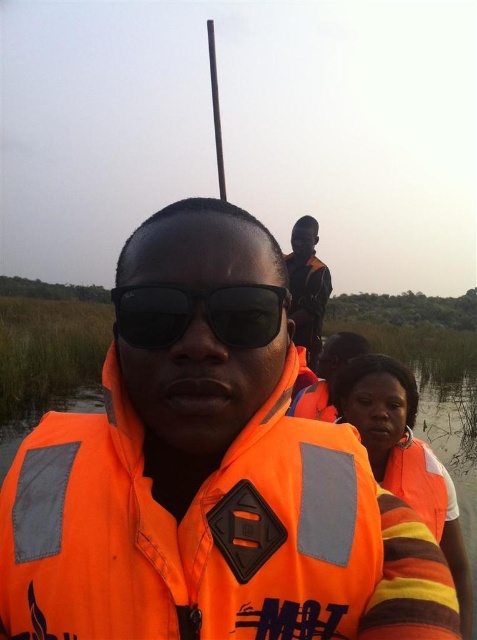
Question: Is orange fabric construction worker at center to the left of orange fabric life jacket at lower right from the viewer's perspective?

Choices:
 (A) yes
 (B) no

Answer: (A)

Question: Which point is closer to the camera?

Choices:
 (A) (276, 323)
 (B) (113, 433)
 (C) (320, 314)
 (D) (429, 486)

Answer: (A)

Question: Can you confirm if orange fabric construction worker at center is wider than orange fabric life jacket at lower right?

Choices:
 (A) yes
 (B) no

Answer: (A)

Question: Based on their relative distances, which object is farther from the orange fabric construction worker at center?

Choices:
 (A) orange fabric life jacket at center
 (B) orange fabric life jacket at lower right
 (C) black matte sunglasses at center

Answer: (C)

Question: Is orange fabric life jacket at center thinner than orange fabric construction worker at center?

Choices:
 (A) yes
 (B) no

Answer: (B)

Question: Which object is closer to the camera taking this photo?

Choices:
 (A) black matte sunglasses at center
 (B) orange fabric construction worker at center

Answer: (A)